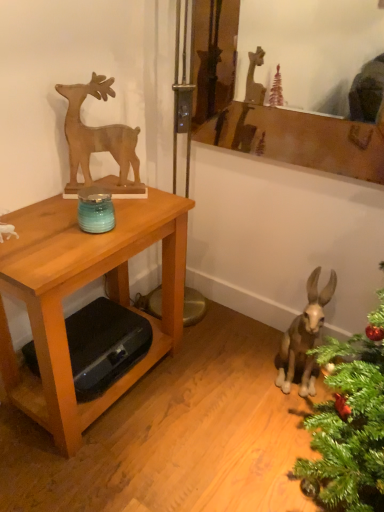
Find the location of `brown matte donkey at lower right`. brown matte donkey at lower right is located at coordinates (305, 337).

Where is `wooden table at left`? This screenshot has width=384, height=512. wooden table at left is located at coordinates (80, 288).

This screenshot has width=384, height=512. Find the location of `wooden mirror at upper center`. wooden mirror at upper center is located at coordinates (309, 48).

This screenshot has width=384, height=512. Find the location of `animal below the wooden deer at upper left (from a real-world perspective)`. animal below the wooden deer at upper left (from a real-world perspective) is located at coordinates (305, 337).

Is wooden deer at upper left placed right next to brown matte donkey at lower right?

No, wooden deer at upper left is not beside brown matte donkey at lower right.

From a real-world perspective, which object stands above the other?

From a 3D spatial view, wooden deer at upper left is above.

Consider the image. Can you tell me how much wooden deer at upper left and brown matte donkey at lower right differ in facing direction?

There is a 24.1-degree angle between the facing directions of wooden deer at upper left and brown matte donkey at lower right.

Are wooden table at left and brown matte donkey at lower right far apart?

No, wooden table at left is not far away from brown matte donkey at lower right.

Between wooden table at left and brown matte donkey at lower right, which one has more height?

Standing taller between the two is wooden table at left.

In the image, is wooden table at left positioned in front of or behind brown matte donkey at lower right?

In the image, wooden table at left appears in front of brown matte donkey at lower right.

The width and height of the screenshot is (384, 512). Identify the location of animal to the right of wooden table at left. (305, 337).

Could you tell me if wooden mirror at upper center is facing wooden deer at upper left?

Yes, wooden mirror at upper center is oriented towards wooden deer at upper left.

Looking at this image, is wooden deer at upper left located within wooden mirror at upper center?

No.

Between wooden mirror at upper center and wooden deer at upper left, which one appears on the right side from the viewer's perspective?

wooden mirror at upper center.

Find the location of `mirror that appears above the wooden deer at upper left (from a real-world perspective)`. mirror that appears above the wooden deer at upper left (from a real-world perspective) is located at coordinates (309, 48).

How different are the orientations of wooden mirror at upper center and wooden table at left in degrees?

91.1 degrees separate the facing orientations of wooden mirror at upper center and wooden table at left.

From the image's perspective, is wooden mirror at upper center positioned above or below wooden table at left?

wooden mirror at upper center is above wooden table at left.

Which object is thinner, wooden mirror at upper center or wooden table at left?

wooden mirror at upper center is thinner.

Is wooden mirror at upper center positioned with its back to wooden table at left?

No, wooden mirror at upper center's orientation is not away from wooden table at left.

Is wooden table at left facing towards wooden deer at upper left?

No, wooden table at left is not oriented towards wooden deer at upper left.

Which of these two, wooden table at left or wooden deer at upper left, is wider?

wooden table at left is wider.

This screenshot has width=384, height=512. Find the location of `table lying on the left of wooden deer at upper left`. table lying on the left of wooden deer at upper left is located at coordinates (80, 288).

Does wooden table at left appear on the right side of wooden deer at upper left?

In fact, wooden table at left is to the left of wooden deer at upper left.

Is wooden table at left turned away from wooden mirror at upper center?

No, wooden table at left is not facing away from wooden mirror at upper center.

Between wooden table at left and wooden mirror at upper center, which one is positioned in front?

wooden table at left.

Is wooden table at left directly adjacent to wooden mirror at upper center?

No, wooden table at left is not in contact with wooden mirror at upper center.

From their relative heights in the image, would you say brown matte donkey at lower right is taller or shorter than wooden deer at upper left?

Considering their sizes, brown matte donkey at lower right has more height than wooden deer at upper left.

Is brown matte donkey at lower right positioned beyond the bounds of wooden deer at upper left?

Yes, brown matte donkey at lower right is located beyond the bounds of wooden deer at upper left.

Which object is wider, brown matte donkey at lower right or wooden deer at upper left?

brown matte donkey at lower right is wider.

Measure the distance between brown matte donkey at lower right and wooden deer at upper left.

The distance of brown matte donkey at lower right from wooden deer at upper left is 38.10 inches.

Where is `animal behind the wooden deer at upper left`? This screenshot has width=384, height=512. animal behind the wooden deer at upper left is located at coordinates (305, 337).

The width and height of the screenshot is (384, 512). Identify the location of animal on the right of wooden table at left. (305, 337).

Based on their spatial positions, is brown matte donkey at lower right or wooden mirror at upper center further from wooden table at left?

Based on the image, wooden mirror at upper center appears to be further to wooden table at left.

In the scene shown: Estimate the real-world distances between objects in this image. Which object is closer to wooden deer at upper left, wooden table at left or wooden mirror at upper center?

wooden table at left is closer to wooden deer at upper left.

Considering their positions, is wooden mirror at upper center positioned further to brown matte donkey at lower right than wooden deer at upper left?

Based on the image, wooden mirror at upper center appears to be further to brown matte donkey at lower right.

Which object lies nearer to the anchor point wooden deer at upper left, brown matte donkey at lower right or wooden table at left?

wooden table at left is positioned closer to the anchor wooden deer at upper left.

Considering their positions, is wooden mirror at upper center positioned further to wooden table at left than brown matte donkey at lower right?

The object further to wooden table at left is wooden mirror at upper center.

Looking at the image, which one is located closer to wooden deer at upper left, wooden mirror at upper center or wooden table at left?

Among the two, wooden table at left is located nearer to wooden deer at upper left.

Consider the image. When comparing their distances from wooden table at left, does wooden deer at upper left or wooden mirror at upper center seem closer?

wooden deer at upper left.

Based on their spatial positions, is wooden deer at upper left or wooden table at left closer to brown matte donkey at lower right?

wooden table at left.

Where is `deer located between wooden table at left and brown matte donkey at lower right in the left-right direction`? deer located between wooden table at left and brown matte donkey at lower right in the left-right direction is located at coordinates (96, 133).

You are a GUI agent. You are given a task and a screenshot of the screen. Output one action in this format:
    pyautogui.click(x=<x>, y=<y>)
    Task: Click on the table between wooden mirror at upper center and brown matte donkey at lower right vertically
    This screenshot has height=512, width=384.
    Given the screenshot: What is the action you would take?
    pyautogui.click(x=80, y=288)

What are the coordinates of `deer that lies between wooden mirror at upper center and brown matte donkey at lower right from top to bottom` in the screenshot? It's located at (96, 133).

The height and width of the screenshot is (512, 384). Identify the location of deer between wooden mirror at upper center and wooden table at left in the vertical direction. click(x=96, y=133).